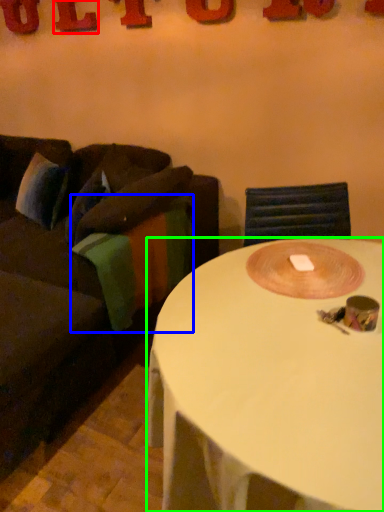
Question: Which is nearer to the letter (highlighted by a red box)? blanket (highlighted by a blue box) or coffee table (highlighted by a green box).

Choices:
 (A) blanket
 (B) coffee table

Answer: (A)